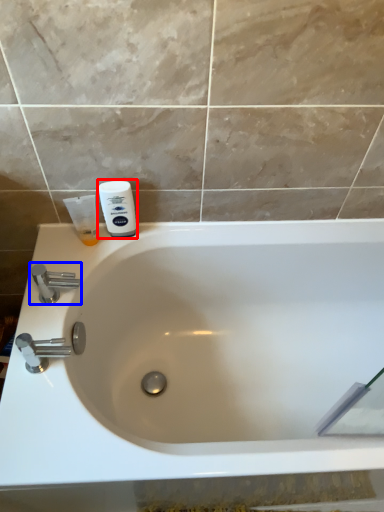
Question: Which object is further to the camera taking this photo, shaving cream (highlighted by a red box) or tap (highlighted by a blue box)?

Choices:
 (A) shaving cream
 (B) tap

Answer: (A)